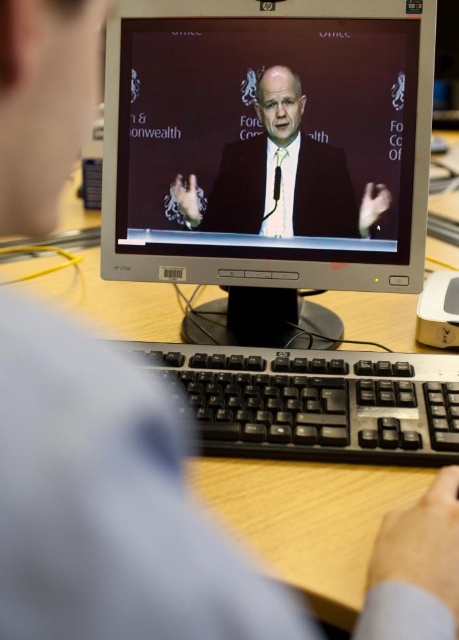
You are organizing a desk and need to place a new mouse between the white plastic monitor at center and the black plastic keyboard at center. Based on their widths, can you determine which side of the monitor the keyboard is on?

The white plastic monitor at center might be wider than black plastic keyboard at center, so the keyboard is likely positioned to the right or left side of the monitor depending on the arrangement, but without exact spatial details, it is uncertain.

You are organizing a virtual meeting and need to ensure that the black plastic keyboard at center and the satin black suit at center are both visible in the camera frame. Which object should you move to the right to make space for the other?

The black plastic keyboard at center is positioned on the left side of the satin black suit at center. To make space for the satin black suit at center, you should move the black plastic keyboard at center to the right.